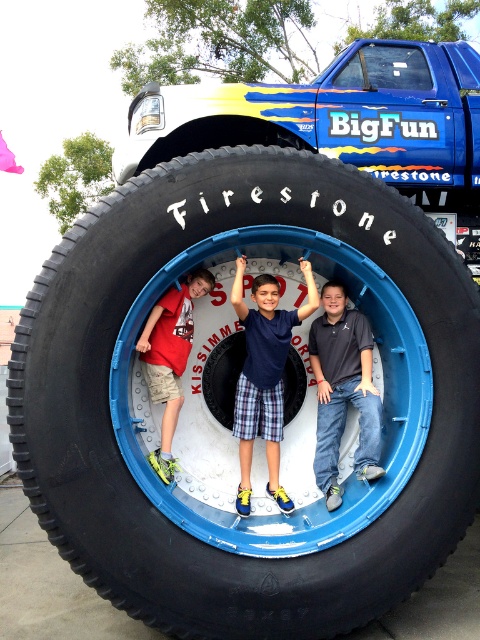
Question: Among these points, which one is farthest from the camera?

Choices:
 (A) (352, 355)
 (B) (445, 138)

Answer: (B)

Question: Where is blue plaid shorts at center located in relation to matte red shirt at center in the image?

Choices:
 (A) right
 (B) left

Answer: (A)

Question: Estimate the real-world distances between objects in this image. Which object is farther from the dark gray cotton shirt at center?

Choices:
 (A) black rubber tire at center
 (B) matte red shirt at center
 (C) blue plaid shorts at center

Answer: (A)

Question: Does black rubber tire at center have a smaller size compared to blue plaid shorts at center?

Choices:
 (A) yes
 (B) no

Answer: (B)

Question: Is blue plaid shorts at center to the right of matte red shirt at center from the viewer's perspective?

Choices:
 (A) yes
 (B) no

Answer: (A)

Question: Among these points, which one is nearest to the camera?

Choices:
 (A) (253, 392)
 (B) (153, 353)
 (C) (360, 390)

Answer: (B)